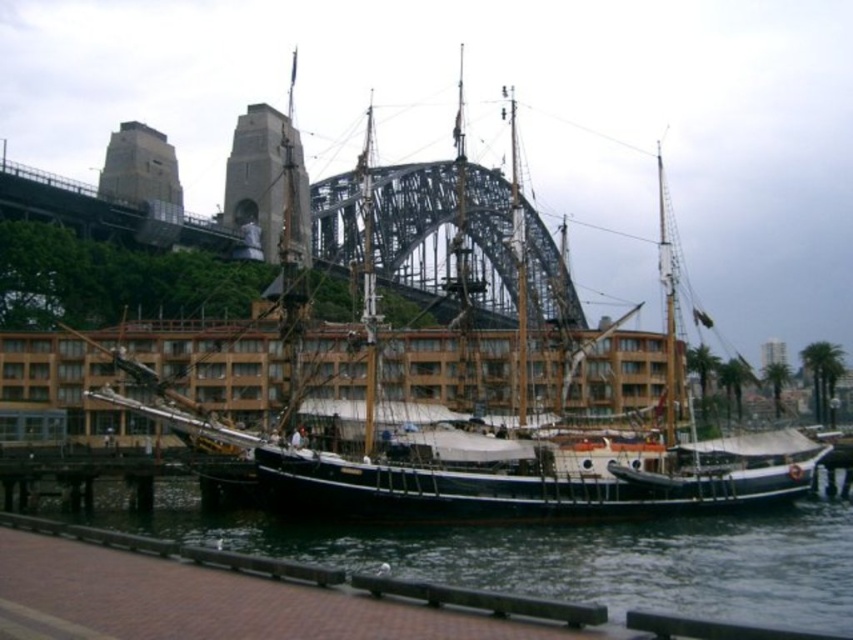
The height and width of the screenshot is (640, 853). What do you see at coordinates (474, 442) in the screenshot?
I see `wooden ship at center` at bounding box center [474, 442].

Is wooden ship at center positioned before black water at lower center?

No, wooden ship at center is further to the viewer.

Is point (670, 401) farther from viewer compared to point (495, 612)?

Yes, it is.

You are a GUI agent. You are given a task and a screenshot of the screen. Output one action in this format:
    pyautogui.click(x=<x>, y=<y>)
    Task: Click on the wooden ship at center
    Image resolution: width=853 pixels, height=640 pixels.
    Given the screenshot: What is the action you would take?
    pyautogui.click(x=474, y=442)

Does point (206, 356) lie in front of point (387, 284)?

Yes, it is.

Which is more to the right, wooden ship at center or metallic steel bridge at upper center?

Positioned to the right is metallic steel bridge at upper center.

What are the coordinates of `wooden ship at center` in the screenshot? It's located at (474, 442).

Between point (33, 195) and point (256, 557), which one is positioned behind?

The point (33, 195) is behind.

Is point (502, 296) in front of point (444, 589)?

No.

The width and height of the screenshot is (853, 640). In order to click on metallic steel bridge at upper center in this screenshot , I will do [x=413, y=225].